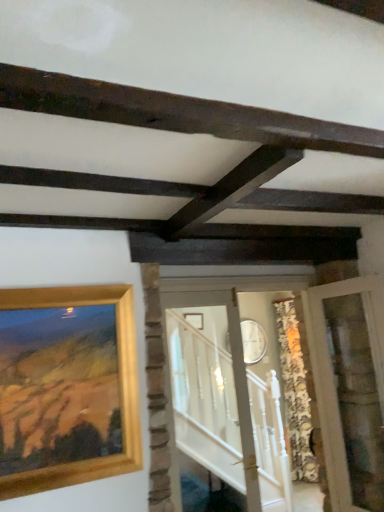
Question: From the image's perspective, is dark brown wood at upper center over clear glass door at right, the second glass door from the left?

Choices:
 (A) no
 (B) yes

Answer: (B)

Question: Can you confirm if dark brown wood at upper center is positioned to the right of clear glass door at right, which is the first glass door from right to left?

Choices:
 (A) no
 (B) yes

Answer: (A)

Question: Considering the relative sizes of dark brown wood at upper center and clear glass door at right, the second glass door from the left, in the image provided, is dark brown wood at upper center taller than clear glass door at right, the second glass door from the left,?

Choices:
 (A) yes
 (B) no

Answer: (B)

Question: Are dark brown wood at upper center and clear glass door at right, the second glass door from the left, far apart?

Choices:
 (A) yes
 (B) no

Answer: (A)

Question: Considering the relative sizes of dark brown wood at upper center and clear glass door at right, which is the first glass door from right to left, in the image provided, is dark brown wood at upper center thinner than clear glass door at right, which is the first glass door from right to left,?

Choices:
 (A) yes
 (B) no

Answer: (A)

Question: From a real-world perspective, is dark brown wood at upper center over clear glass door at right, which is the first glass door from right to left?

Choices:
 (A) yes
 (B) no

Answer: (A)

Question: From a real-world perspective, does dark brown wood at upper center sit lower than gold wooden picture frame at upper left?

Choices:
 (A) no
 (B) yes

Answer: (A)

Question: Is dark brown wood at upper center at the right side of gold wooden picture frame at upper left?

Choices:
 (A) yes
 (B) no

Answer: (A)

Question: Is dark brown wood at upper center outside of gold wooden picture frame at upper left?

Choices:
 (A) yes
 (B) no

Answer: (A)

Question: Does dark brown wood at upper center have a greater width compared to gold wooden picture frame at upper left?

Choices:
 (A) no
 (B) yes

Answer: (B)

Question: Is the depth of dark brown wood at upper center greater than that of gold wooden picture frame at upper left?

Choices:
 (A) yes
 (B) no

Answer: (B)

Question: Is dark brown wood at upper center turned away from gold wooden picture frame at upper left?

Choices:
 (A) yes
 (B) no

Answer: (B)

Question: Would you say gold wooden picture frame at upper left contains dark brown wood at upper center?

Choices:
 (A) yes
 (B) no

Answer: (B)